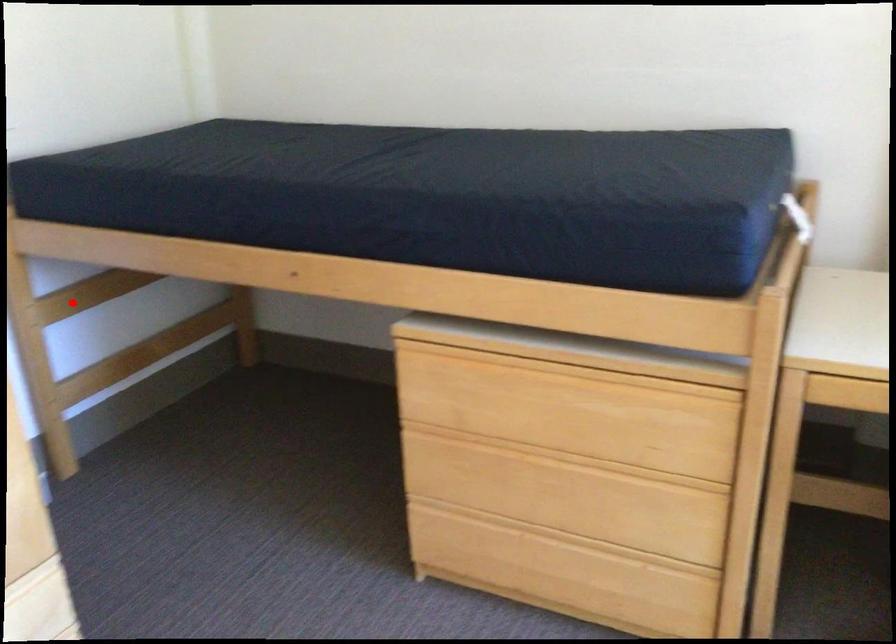
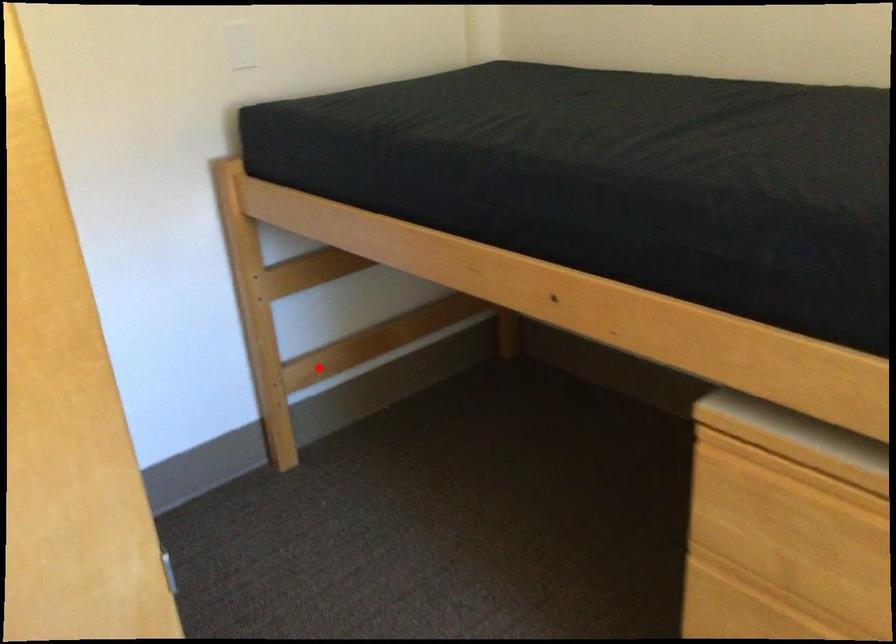
I am providing you with two images of the same scene from different viewpoints. A red point is marked on the first image and another point is marked on the second image. Does the point marked in image1 correspond to the same location as the one in image2?

No